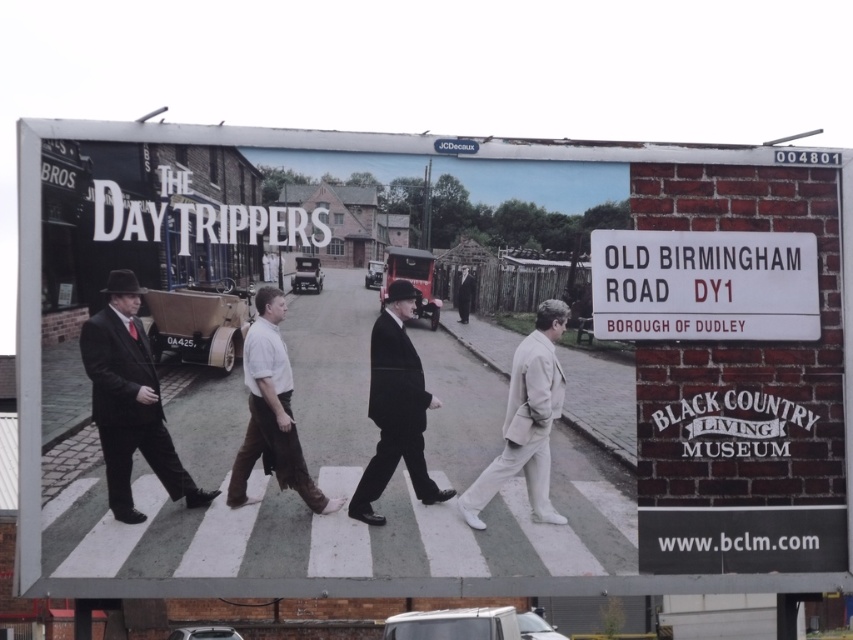
In the scene shown: You are standing in front of the billboard for The Day Trippers. You want to locate the black wool suit at center. Where exactly should you look on the billboard?

The black wool suit at center is located at point coordinates of (395, 408) on the billboard.

You are standing in front of the billboard for The Day Trippers and want to find the exact location mentioned on the white plastic sign at upper right. Based on the scene description, can you determine the coordinates where the sign is placed?

The white plastic sign at upper right is located at point [704,285], so the coordinates are 0.447 on the x axis and 0.826 on the y axis.